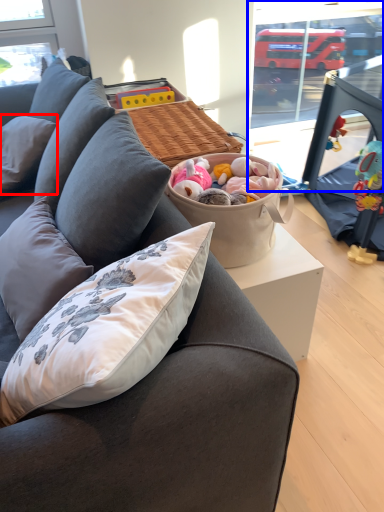
Question: Which object appears closest to the camera in this image, pillow (highlighted by a red box) or window screen (highlighted by a blue box)?

Choices:
 (A) pillow
 (B) window screen

Answer: (B)